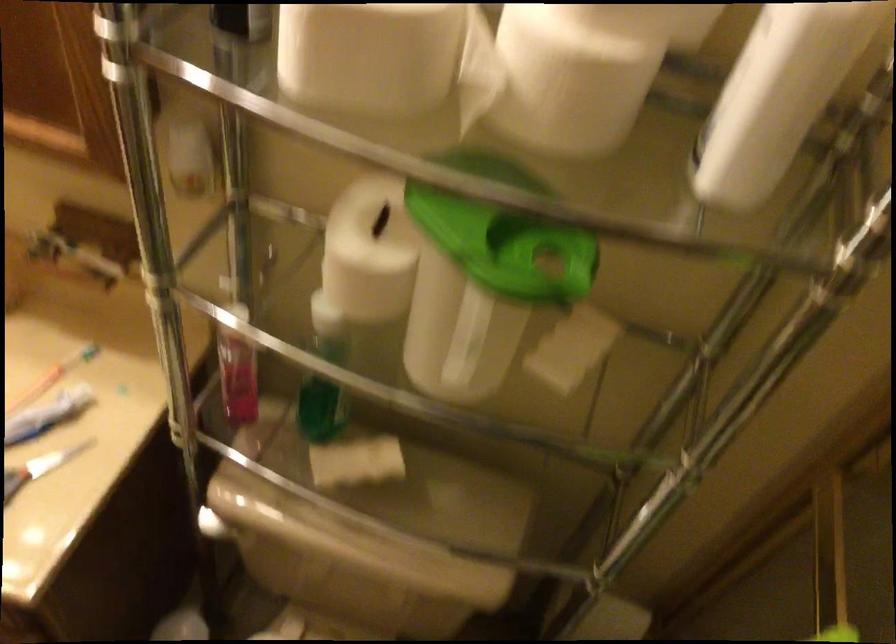
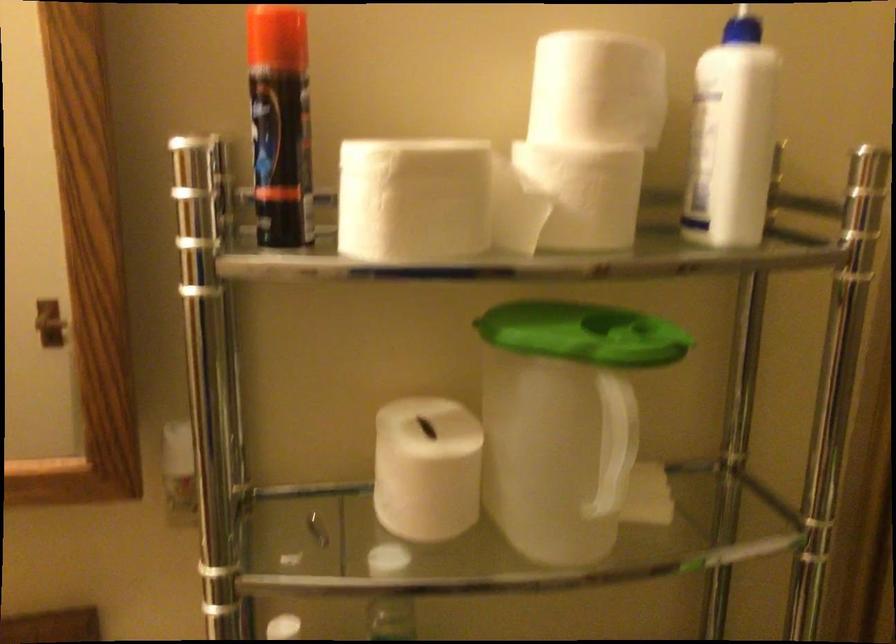
Find the pixel in the second image that matches the point at 347,265 in the first image.

(426, 469)